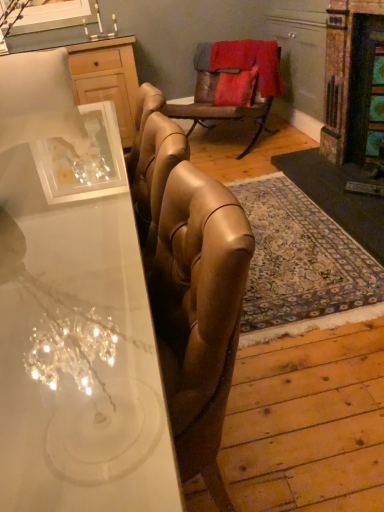
Question: Is white glossy desk at center in front of or behind rustic stone fireplace at right in the image?

Choices:
 (A) behind
 (B) front

Answer: (B)

Question: From a real-world perspective, is white glossy desk at center above or below rustic stone fireplace at right?

Choices:
 (A) below
 (B) above

Answer: (A)

Question: Which object is positioned farthest from the rustic stone fireplace at right?

Choices:
 (A) leather armchair at center
 (B) wooden cabinet at upper left
 (C) white glossy desk at center

Answer: (C)

Question: Which object is positioned farthest from the leather armchair at center?

Choices:
 (A) wooden cabinet at upper left
 (B) rustic stone fireplace at right
 (C) white glossy desk at center

Answer: (C)